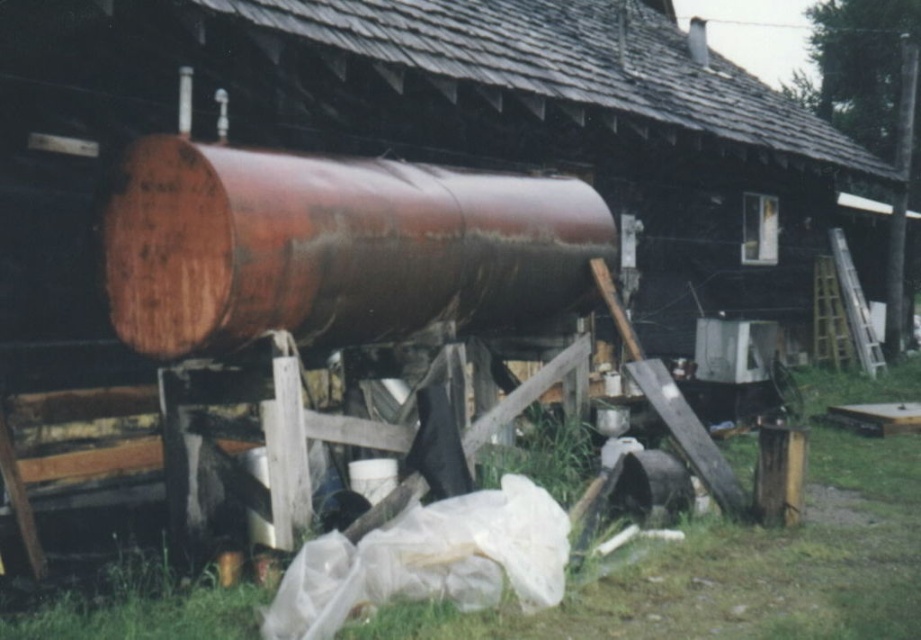
Is rusty metal barrel at center below green grass at lower center?

No, rusty metal barrel at center is not below green grass at lower center.

Which of these two, rusty metal barrel at center or green grass at lower center, stands taller?

rusty metal barrel at center is taller.

Find the location of a particular element. rusty metal barrel at center is located at coordinates (335, 248).

This screenshot has height=640, width=921. I want to click on rusty metal barrel at center, so click(335, 248).